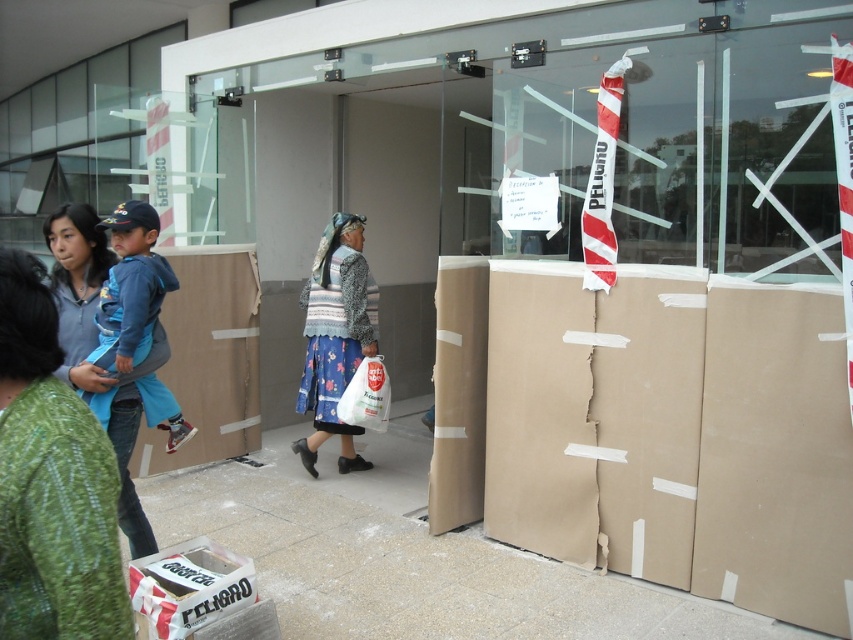
You are standing on the smooth concrete pavement at lower center and want to reach the building entrance. The entrance is 3.09 meters away. If you take 2 steps of 1.5 meters each, will you reach the entrance?

Yes, because 2 steps of 1.5 meters each total 3 meters, which is just enough to cover the 3.09 meters distance to the building entrance.